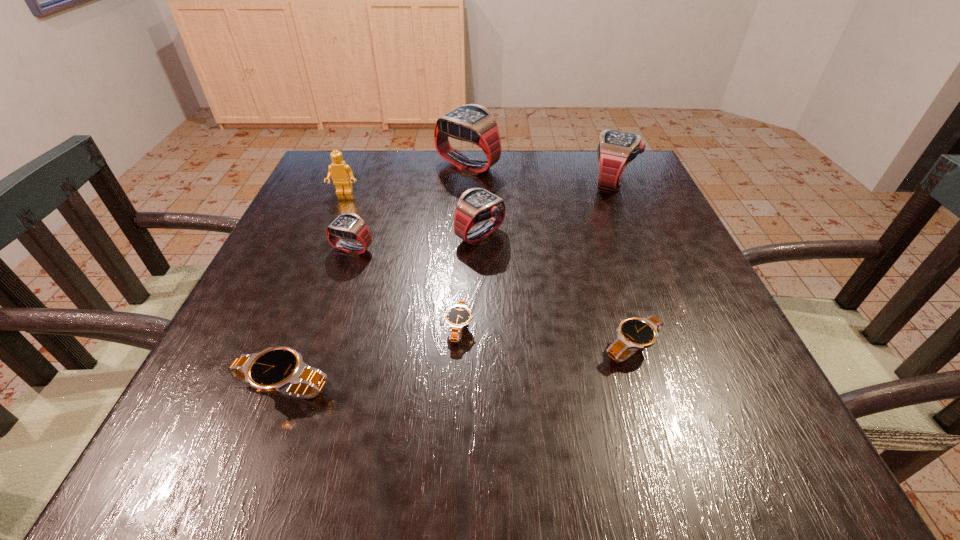
Find the location of a particular element. This screenshot has height=540, width=960. the second smallest black watch is located at coordinates (634, 333).

Where is `the rightmost black watch`? The width and height of the screenshot is (960, 540). the rightmost black watch is located at coordinates (634, 333).

This screenshot has width=960, height=540. Identify the location of the smallest black watch. (458, 316).

I want to click on the shortest object, so click(458, 316).

Identify the location of vacant space located 0.110m on the left of the biggest red watch. pos(395,166).

This screenshot has width=960, height=540. What are the coordinates of `vacant space located 0.140m on the left of the second biggest red watch` in the screenshot? It's located at (536, 181).

In order to click on vacant space located 0.290m on the face of the Lego in this screenshot , I will do `click(309, 278)`.

The image size is (960, 540). I want to click on free space located on the front of the second smallest red watch, so pyautogui.click(x=480, y=427).

Where is `blank space located 0.090m on the right of the smallest red watch`? This screenshot has height=540, width=960. blank space located 0.090m on the right of the smallest red watch is located at coordinates (417, 248).

This screenshot has width=960, height=540. I want to click on vacant space located on the back of the biggest black watch, so click(307, 325).